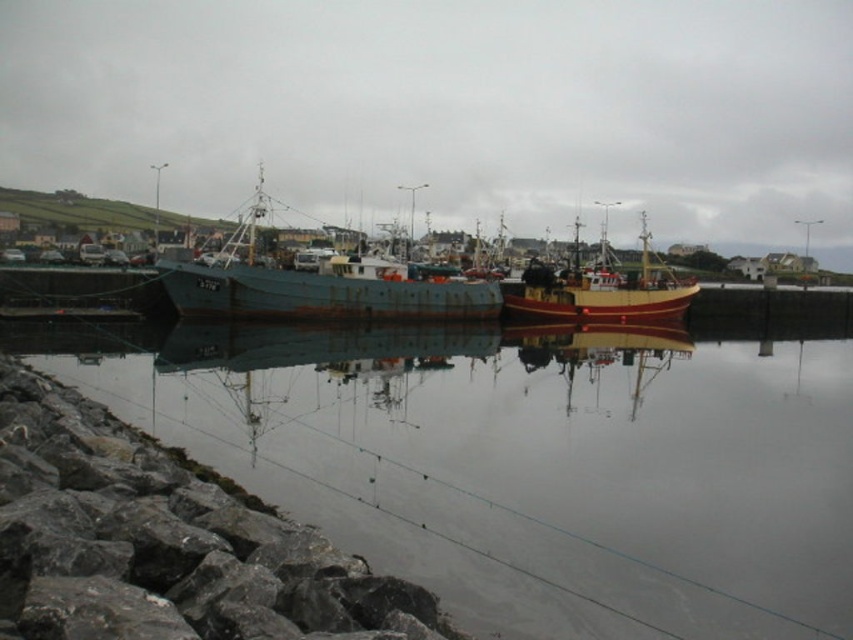
Is rusty metal boat at center to the left of wooden boat at center from the viewer's perspective?

Indeed, rusty metal boat at center is positioned on the left side of wooden boat at center.

Can you confirm if rusty metal boat at center is positioned above wooden boat at center?

No, rusty metal boat at center is not above wooden boat at center.

Who is more forward, (248, 209) or (657, 317)?

Point (248, 209) is more forward.

What are the coordinates of `rusty metal boat at center` in the screenshot? It's located at (325, 291).

Does smooth reflective water at center have a smaller size compared to gray rock at lower left?

Actually, smooth reflective water at center might be larger than gray rock at lower left.

Can you confirm if smooth reflective water at center is wider than gray rock at lower left?

Correct, the width of smooth reflective water at center exceeds that of gray rock at lower left.

Find the location of `smooth reflective water at center`. smooth reflective water at center is located at coordinates (523, 464).

I want to click on smooth reflective water at center, so click(x=523, y=464).

Is smooth reflective water at center smaller than rusty metal boat at center?

No.

Who is taller, smooth reflective water at center or rusty metal boat at center?

With more height is rusty metal boat at center.

Between point (309, 492) and point (231, 288), which one is positioned in front?

Point (309, 492)

Locate an element on the screen. The width and height of the screenshot is (853, 640). smooth reflective water at center is located at coordinates (523, 464).